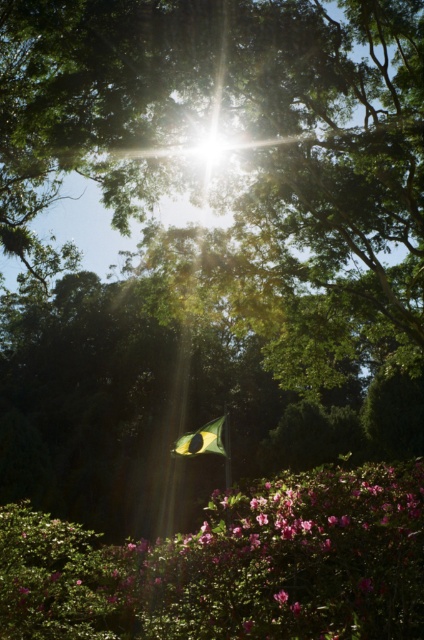
Question: Is yellow-green fabric flag at center positioned at the back of pink matte flower at center?

Choices:
 (A) no
 (B) yes

Answer: (B)

Question: Is yellow-green fabric flag at center to the left of pink matte flower at center from the viewer's perspective?

Choices:
 (A) no
 (B) yes

Answer: (B)

Question: Is yellow-green fabric flag at center above pink matte flower at center?

Choices:
 (A) yes
 (B) no

Answer: (B)

Question: Which point is closer to the camera taking this photo?

Choices:
 (A) (209, 426)
 (B) (279, 596)

Answer: (B)

Question: Which point is closer to the camera?

Choices:
 (A) pink matte flower at center
 (B) yellow-green fabric flag at center

Answer: (A)

Question: Which of the following is the closest to the observer?

Choices:
 (A) pink matte flower at center
 (B) yellow-green fabric flag at center

Answer: (A)